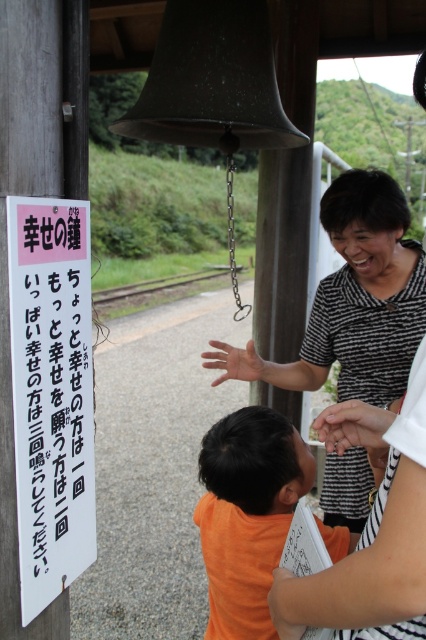
Is striped fabric blouse at center wider than smooth skin hand at center?

Yes.

Who is more forward, [365,205] or [296,378]?

Point [365,205] is in front.

Where is `striped fabric blouse at center`? Image resolution: width=426 pixels, height=640 pixels. striped fabric blouse at center is located at coordinates point(367,291).

Can you confirm if smooth white hand at center is shorter than smooth skin hand at center?

Correct, smooth white hand at center is not as tall as smooth skin hand at center.

Which is behind, point (368, 429) or point (219, 376)?

Positioned behind is point (219, 376).

Where is `smooth white hand at center`? This screenshot has width=426, height=640. smooth white hand at center is located at coordinates (353, 426).

Based on the photo, does pink paper sign at left have a larger size compared to smooth skin hand at center?

No, pink paper sign at left is not bigger than smooth skin hand at center.

Can you confirm if pink paper sign at left is wider than smooth skin hand at center?

No, pink paper sign at left is not wider than smooth skin hand at center.

What are the coordinates of `pink paper sign at left` in the screenshot? It's located at tap(51, 394).